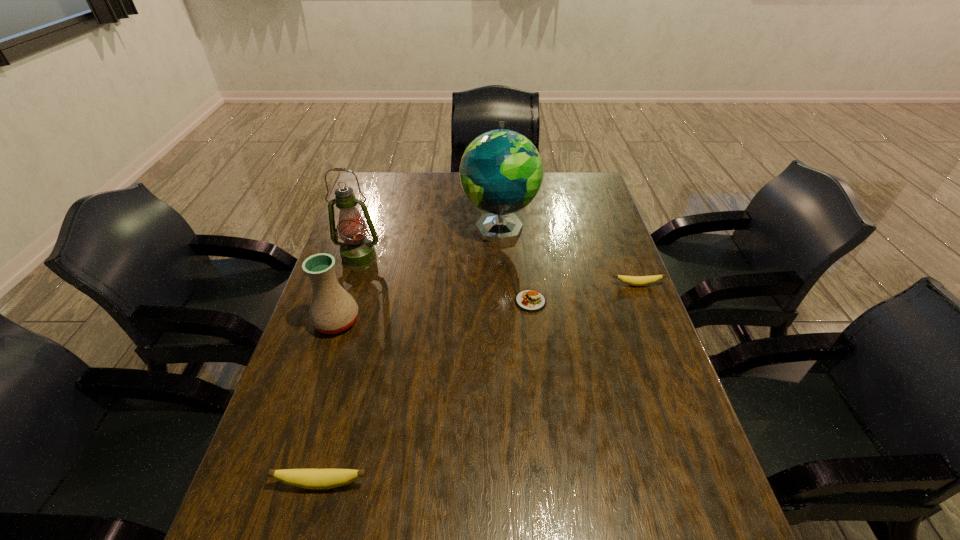
Image resolution: width=960 pixels, height=540 pixels. Find the location of `vacant position located on the front surface of the globe`. vacant position located on the front surface of the globe is located at coordinates (504, 312).

This screenshot has width=960, height=540. In order to click on vacant region located on the back of the fourth shortest object in this screenshot , I will do point(347,290).

Where is `free space located 0.270m on the front of the patty (food)`? The image size is (960, 540). free space located 0.270m on the front of the patty (food) is located at coordinates (542, 397).

This screenshot has width=960, height=540. Identify the location of blank space located 0.300m on the back of the oil lamp. (378, 198).

Where is `object that is at the near edge`? object that is at the near edge is located at coordinates pos(318,479).

At what (x,y) coordinates should I click in order to perform the action: click on banana that is at the left edge. Please return your answer as a coordinate pair (x, y). The height and width of the screenshot is (540, 960). Looking at the image, I should click on (318, 479).

I want to click on pottery situated at the left edge, so point(332,310).

Identify the location of oil lamp located in the left edge section of the desktop. (357, 252).

Locate an element on the screen. The width and height of the screenshot is (960, 540). object that is at the right edge is located at coordinates (631, 280).

You are a GUI agent. You are given a task and a screenshot of the screen. Output one action in this format:
    pyautogui.click(x=<x>, y=<y>)
    Task: Click on the object that is at the near left corner
    This screenshot has height=540, width=960.
    Given the screenshot: What is the action you would take?
    pyautogui.click(x=318, y=479)